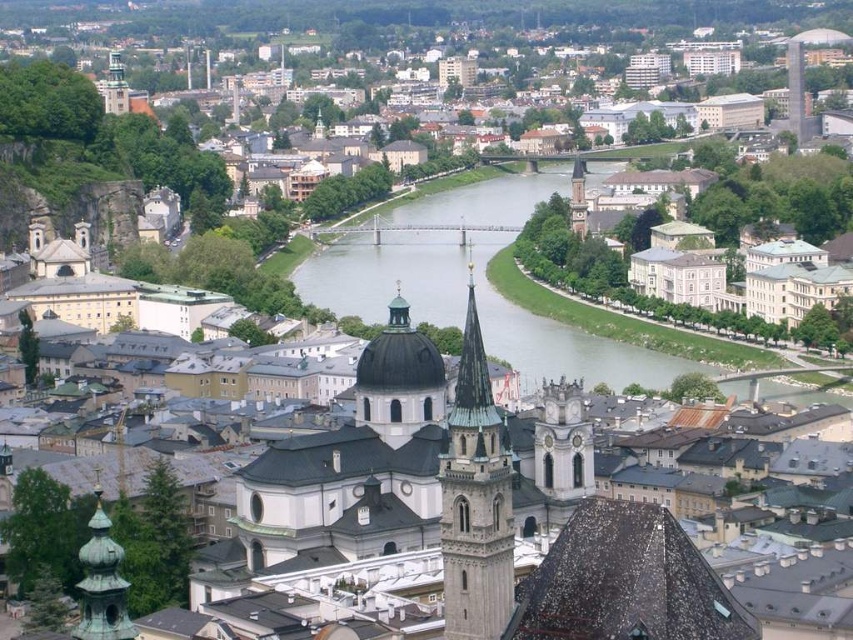
Question: Which object is closer to the camera taking this photo?

Choices:
 (A) silvery waterway at center
 (B) matte gold clock tower at upper left
 (C) white stone dome at center
 (D) smooth stone tower at center

Answer: (D)

Question: Does white stone dome at center have a greater width compared to matte gold clock tower at upper left?

Choices:
 (A) no
 (B) yes

Answer: (A)

Question: Is green copper tower at lower left to the right of matte gold clock tower at upper left from the viewer's perspective?

Choices:
 (A) yes
 (B) no

Answer: (A)

Question: Among these points, which one is nearest to the camera?

Choices:
 (A) (556, 444)
 (B) (117, 65)

Answer: (A)

Question: Which object is the farthest from the green copper tower at lower left?

Choices:
 (A) silvery waterway at center
 (B) white stone clock tower at center

Answer: (A)

Question: Can you confirm if silvery waterway at center is positioned below matte gold clock tower at upper left?

Choices:
 (A) no
 (B) yes

Answer: (B)